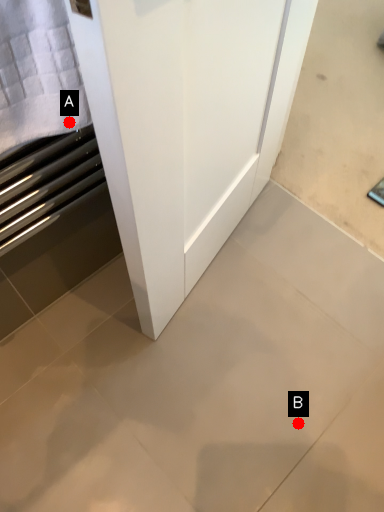
Question: Two points are circled on the image, labeled by A and B beside each circle. Which point appears farthest from the camera in this image?

Choices:
 (A) A is further
 (B) B is further

Answer: (B)